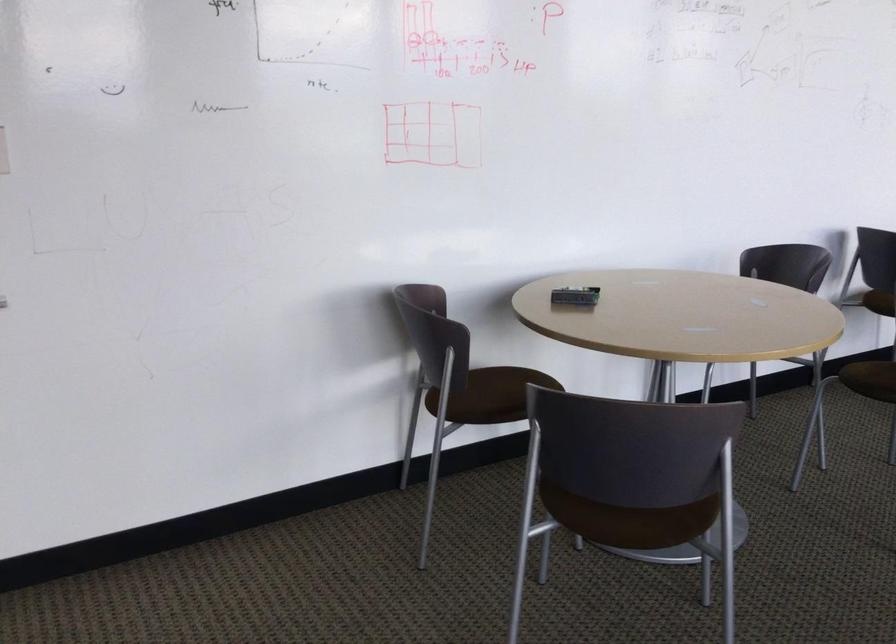
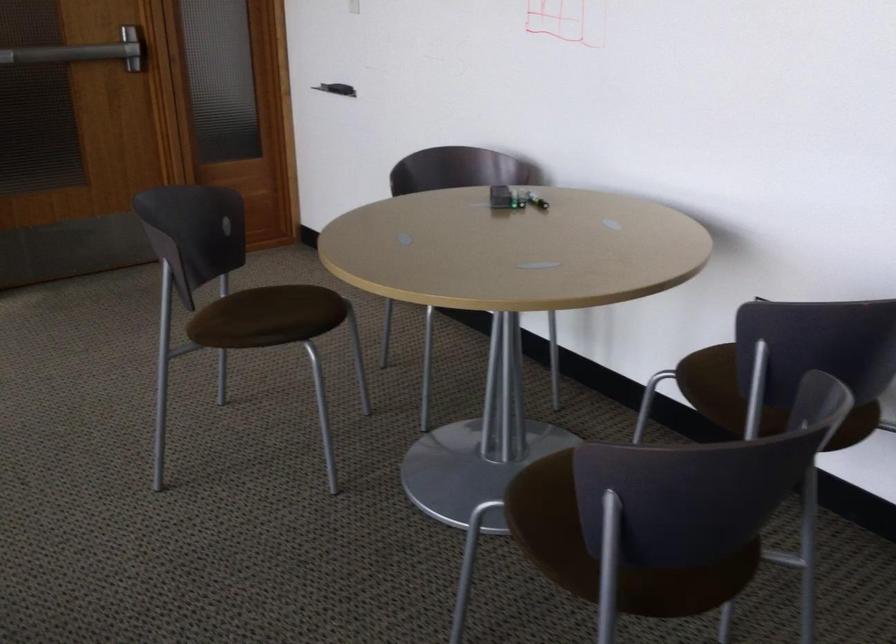
Find the pixel in the second image that matches point 580,297 in the first image.

(498, 198)